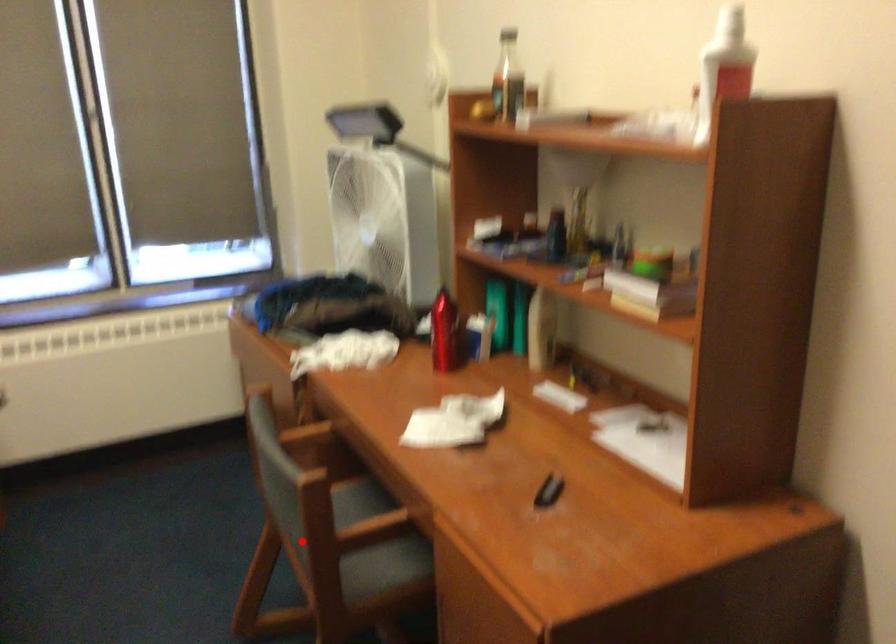
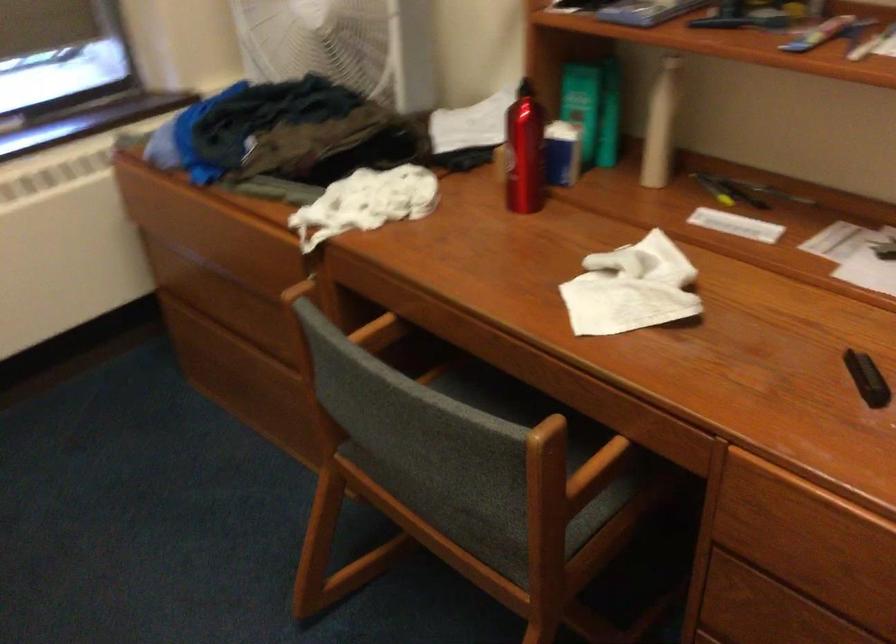
Question: A red point is marked in image1. In image2, is the corresponding 3D point closer to the camera or farther? Reply with the corresponding letter.

Choices:
 (A) The corresponding 3D point is closer.
 (B) The corresponding 3D point is farther.

Answer: (A)